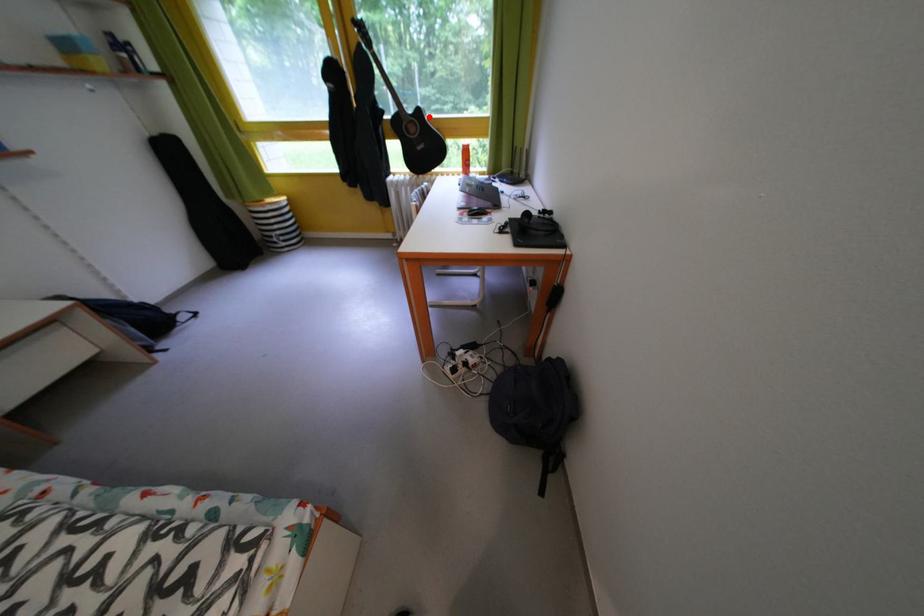
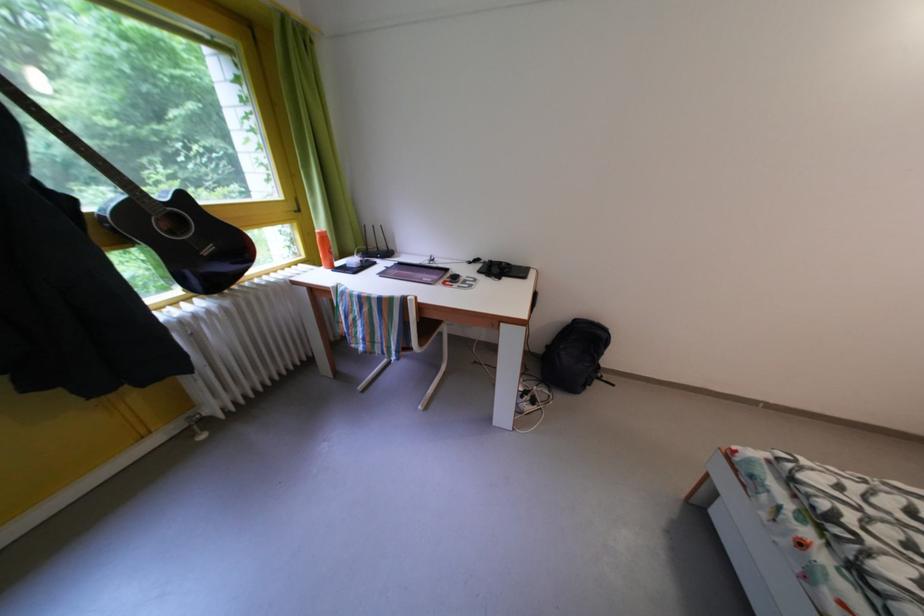
Where in the second image is the point corresponding to the highlighted location from the first image?

(191, 203)